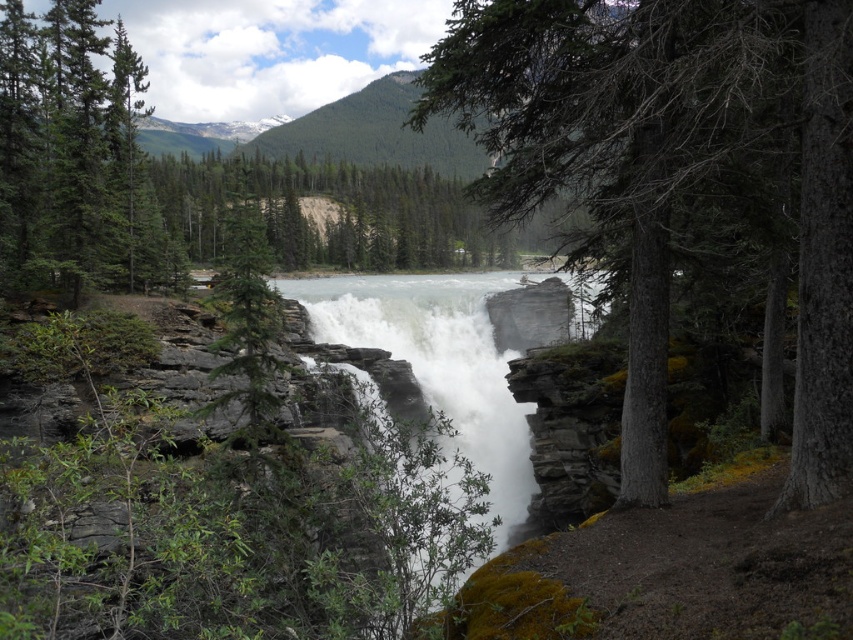
You are a hiker standing at the edge of the cliff overlooking the waterfall. You notice the green rough bark tree at center and the white frothy water at center. Which object would block your view of the other if you were to stand directly in front of one?

The green rough bark tree at center has a larger size compared to the white frothy water at center, so if you stand directly in front of the tree, it would block your view of the white frothy water at center.

You are standing at the origin point of the image, which is the bottom left corner. You want to walk towards the green rough bark tree at center. In which direction should you move first?

Since the green rough bark tree at center is located at coordinates approximately 0.264 on the x axis and 0.789 on the y axis, you should first move to the right along the x axis to reach the tree.

You are a hiker trying to navigate through the forest near the waterfall. You see a green rough bark tree at center and a green matte tree at upper left. Which tree is located to the right of the other?

The green rough bark tree at center is positioned on the right side of green matte tree at upper left.